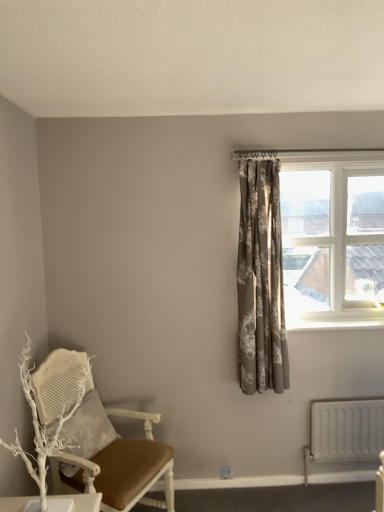
Measure the distance between silvery-grey floral curtain at upper right and camera.

The depth of silvery-grey floral curtain at upper right is 2.40 meters.

The width and height of the screenshot is (384, 512). I want to click on white painted wood chair at left, so click(114, 455).

Consider the image. Is white matte branch at lower left facing towards white plastic window at upper right?

No, white matte branch at lower left is not facing towards white plastic window at upper right.

Identify the location of branch in front of the white plastic window at upper right. (44, 429).

From the image's perspective, is white matte branch at lower left above or below white plastic window at upper right?

From the image's perspective, white matte branch at lower left appears below white plastic window at upper right.

Between point (102, 430) and point (233, 156), which one is positioned in front?

Positioned in front is point (102, 430).

Can you tell me how much white textured pillow at lower left and white plastic window at upper right differ in facing direction?

63.9 degrees.

Do you think white textured pillow at lower left is within white plastic window at upper right, or outside of it?

white textured pillow at lower left is located beyond the bounds of white plastic window at upper right.

Is white textured pillow at lower left aimed at white plastic window at upper right?

No.

Does white plastic window at upper right have a larger size compared to white matte branch at lower left?

Yes, white plastic window at upper right is bigger than white matte branch at lower left.

Can you confirm if white plastic window at upper right is positioned to the left of white matte branch at lower left?

No, white plastic window at upper right is not to the left of white matte branch at lower left.

From the image's perspective, is white plastic window at upper right beneath white matte branch at lower left?

Incorrect, from the image's perspective, white plastic window at upper right is higher than white matte branch at lower left.

Is white plastic window at upper right further to the viewer compared to white matte branch at lower left?

Yes.

Is white matte branch at lower left looking in the opposite direction of white painted wood chair at left?

That's not correct — white matte branch at lower left is not looking away from white painted wood chair at left.

Is white matte branch at lower left located outside white painted wood chair at left?

Yes, white matte branch at lower left is outside of white painted wood chair at left.

Based on their sizes in the image, would you say white matte branch at lower left is bigger or smaller than white painted wood chair at left?

Considering their sizes, white matte branch at lower left takes up less space than white painted wood chair at left.

Considering the sizes of objects white painted wood at upper right and white textured pillow at lower left in the image provided, who is taller, white painted wood at upper right or white textured pillow at lower left?

With more height is white textured pillow at lower left.

Which is more to the left, white painted wood at upper right or white textured pillow at lower left?

white textured pillow at lower left.

Considering the sizes of objects white painted wood at upper right and white textured pillow at lower left in the image provided, who is bigger, white painted wood at upper right or white textured pillow at lower left?

white textured pillow at lower left.

From the image's perspective, is white textured pillow at lower left on top of silvery-grey floral curtain at upper right?

No.

Can you tell me how much white textured pillow at lower left and silvery-grey floral curtain at upper right differ in facing direction?

There is a 63.5-degree angle between the facing directions of white textured pillow at lower left and silvery-grey floral curtain at upper right.

Measure the distance between white textured pillow at lower left and silvery-grey floral curtain at upper right.

white textured pillow at lower left is 3.52 feet from silvery-grey floral curtain at upper right.

Considering the sizes of objects white textured pillow at lower left and silvery-grey floral curtain at upper right in the image provided, who is wider, white textured pillow at lower left or silvery-grey floral curtain at upper right?

silvery-grey floral curtain at upper right.

Between silvery-grey floral curtain at upper right and white matte radiator at lower right, which one is positioned behind?

white matte radiator at lower right is further away from the camera.

Is white matte radiator at lower right inside silvery-grey floral curtain at upper right?

That's incorrect, white matte radiator at lower right is not inside silvery-grey floral curtain at upper right.

How far apart are silvery-grey floral curtain at upper right and white matte radiator at lower right?

silvery-grey floral curtain at upper right is 24.36 inches from white matte radiator at lower right.

The height and width of the screenshot is (512, 384). In order to click on branch that appears below the white plastic window at upper right (from a real-world perspective) in this screenshot , I will do `click(44, 429)`.

You are a GUI agent. You are given a task and a screenshot of the screen. Output one action in this format:
    pyautogui.click(x=<x>, y=<y>)
    Task: Click on the window lying on the right of white textured pillow at lower left
    This screenshot has width=384, height=512.
    Given the screenshot: What is the action you would take?
    pyautogui.click(x=331, y=236)

Which object lies nearer to the anchor point white textured pillow at lower left, white matte radiator at lower right or silvery-grey floral curtain at upper right?

silvery-grey floral curtain at upper right is positioned closer to the anchor white textured pillow at lower left.

Considering their positions, is white painted wood at upper right positioned further to white matte branch at lower left than white matte radiator at lower right?

Among the two, white matte radiator at lower right is located further to white matte branch at lower left.

Considering their positions, is white painted wood chair at left positioned closer to white matte branch at lower left than white painted wood at upper right?

Based on the image, white painted wood chair at left appears to be nearer to white matte branch at lower left.

Considering their positions, is silvery-grey floral curtain at upper right positioned closer to white textured pillow at lower left than white plastic window at upper right?

silvery-grey floral curtain at upper right.

Based on their spatial positions, is white matte branch at lower left or silvery-grey floral curtain at upper right closer to white plastic window at upper right?

silvery-grey floral curtain at upper right lies closer to white plastic window at upper right than the other object.

Considering their positions, is silvery-grey floral curtain at upper right positioned further to white painted wood at upper right than white textured pillow at lower left?

white textured pillow at lower left is further to white painted wood at upper right.

Based on their spatial positions, is white matte branch at lower left or white plastic window at upper right closer to white matte radiator at lower right?

A: white plastic window at upper right is positioned closer to the anchor white matte radiator at lower right.

From the image, which object appears to be farther from silvery-grey floral curtain at upper right, white textured pillow at lower left or white plastic window at upper right?

white textured pillow at lower left is further to silvery-grey floral curtain at upper right.

What are the coordinates of `window sill between white painted wood chair at left and white matte radiator at lower right` in the screenshot? It's located at (333, 324).

The image size is (384, 512). Find the location of `curtain between white painted wood chair at left and white plastic window at upper right in the horizontal direction`. curtain between white painted wood chair at left and white plastic window at upper right in the horizontal direction is located at coordinates (261, 280).

Find the location of a particular element. The width and height of the screenshot is (384, 512). chair between white textured pillow at lower left and white matte radiator at lower right in the horizontal direction is located at coordinates (114, 455).

Where is `curtain between white matte branch at lower left and white matte radiator at lower right`? This screenshot has width=384, height=512. curtain between white matte branch at lower left and white matte radiator at lower right is located at coordinates (261, 280).